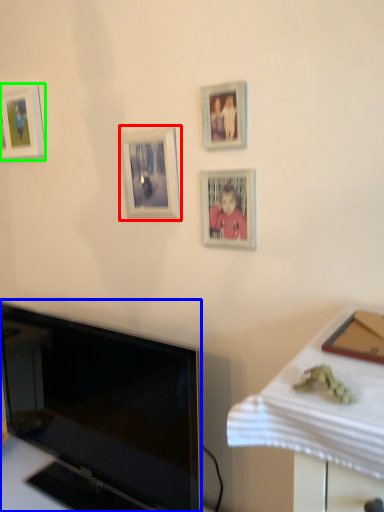
Question: Which object is positioned closest to picture frame (highlighted by a red box)? Select from television (highlighted by a blue box) and picture frame (highlighted by a green box).

Choices:
 (A) television
 (B) picture frame

Answer: (B)